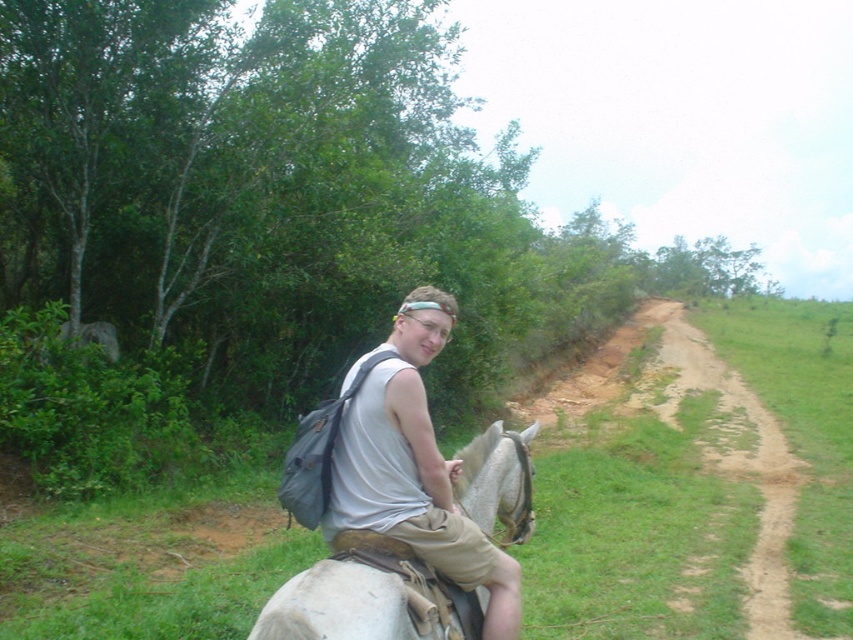
Is gray fabric backpack at center wider than white matte horse at center?

Yes, gray fabric backpack at center is wider than white matte horse at center.

Locate an element on the screen. gray fabric backpack at center is located at coordinates (415, 465).

Consider the image. Is gray fabric backpack at center bigger than brown dirt path at center right?

No, gray fabric backpack at center is not bigger than brown dirt path at center right.

Between gray fabric backpack at center and brown dirt path at center right, which one is positioned higher?

gray fabric backpack at center is above.

Who is more forward, [451,328] or [764,632]?

Point [451,328]

Where is `gray fabric backpack at center`? gray fabric backpack at center is located at coordinates (415, 465).

Where is `white matte horse at center`? white matte horse at center is located at coordinates (361, 596).

Can you confirm if white matte horse at center is positioned below brown dirt path at center right?

No, white matte horse at center is not below brown dirt path at center right.

In order to click on white matte horse at center in this screenshot , I will do `click(361, 596)`.